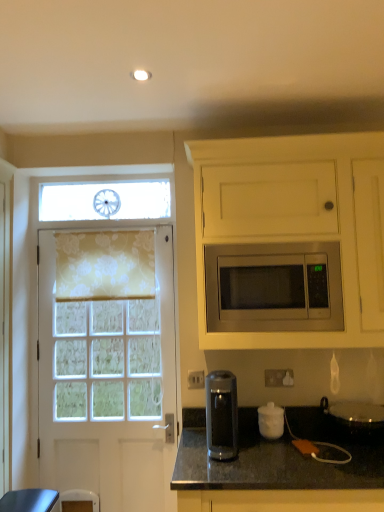
Question: Does white floral fabric at left have a greater height compared to black granite countertop at lower center?

Choices:
 (A) no
 (B) yes

Answer: (B)

Question: From the image's perspective, is white floral fabric at left above black granite countertop at lower center?

Choices:
 (A) yes
 (B) no

Answer: (A)

Question: From a real-world perspective, does white floral fabric at left sit lower than black granite countertop at lower center?

Choices:
 (A) yes
 (B) no

Answer: (B)

Question: Does white floral fabric at left have a lesser height compared to black granite countertop at lower center?

Choices:
 (A) no
 (B) yes

Answer: (A)

Question: Considering the relative positions of white floral fabric at left and black granite countertop at lower center in the image provided, is white floral fabric at left to the left of black granite countertop at lower center from the viewer's perspective?

Choices:
 (A) no
 (B) yes

Answer: (B)

Question: Does white floral fabric at left have a smaller size compared to black granite countertop at lower center?

Choices:
 (A) no
 (B) yes

Answer: (B)

Question: Is stainless steel microwave at center looking in the opposite direction of white matte jar at lower center, the 2th appliance from the right?

Choices:
 (A) yes
 (B) no

Answer: (B)

Question: Can you confirm if stainless steel microwave at center is taller than white matte jar at lower center, which is counted as the 1th appliance, starting from the left?

Choices:
 (A) yes
 (B) no

Answer: (A)

Question: Is white matte jar at lower center, the 2th appliance from the right, inside stainless steel microwave at center?

Choices:
 (A) no
 (B) yes

Answer: (A)

Question: From a real-world perspective, is stainless steel microwave at center below white matte jar at lower center, the 2th appliance from the right?

Choices:
 (A) yes
 (B) no

Answer: (B)

Question: Is stainless steel microwave at center completely or partially outside of white matte jar at lower center, which is counted as the 1th appliance, starting from the left?

Choices:
 (A) no
 (B) yes

Answer: (B)

Question: Is stainless steel microwave at center to the right of white matte jar at lower center, which is counted as the 1th appliance, starting from the left, from the viewer's perspective?

Choices:
 (A) yes
 (B) no

Answer: (B)

Question: Is stainless steel microwave at center positioned beyond the bounds of transparent plastic coffee machine at lower center?

Choices:
 (A) yes
 (B) no

Answer: (A)